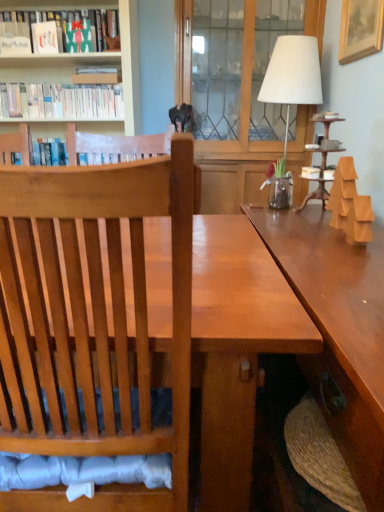
Question: Is point (254, 29) closer or farther from the camera than point (1, 98)?

Choices:
 (A) closer
 (B) farther

Answer: (B)

Question: Is transparent glass door at center to the left or to the right of white matte bookshelf at upper left, which appears as the first book when ordered from the bottom, in the image?

Choices:
 (A) right
 (B) left

Answer: (A)

Question: Which object is positioned farthest from the transparent glass door at center?

Choices:
 (A) gold wooden picture frame at upper right
 (B) matte cardboard box at upper left, positioned as the 2th book in bottom-to-top order
 (C) shiny brown table at center
 (D) matte green book at upper left, which is counted as the first book, starting from the top
 (E) white fabric lampshade at upper right

Answer: (C)

Question: Which is farther from the white matte bookshelf at upper left, which is the 3th book from top to bottom?

Choices:
 (A) matte green book at upper left, which is counted as the first book, starting from the top
 (B) transparent glass door at center
 (C) shiny brown table at center
 (D) gold wooden picture frame at upper right
 (E) white fabric lampshade at upper right

Answer: (C)